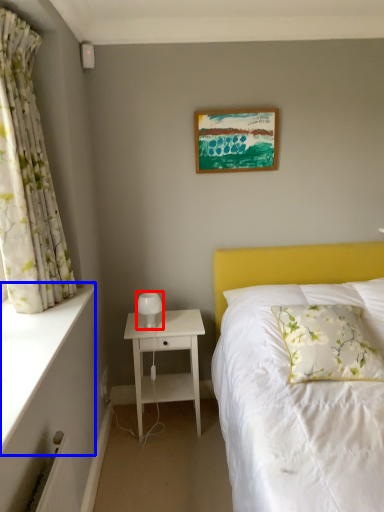
Question: Which of the following is the farthest to the observer, table lamp (highlighted by a red box) or ledge (highlighted by a blue box)?

Choices:
 (A) table lamp
 (B) ledge

Answer: (A)